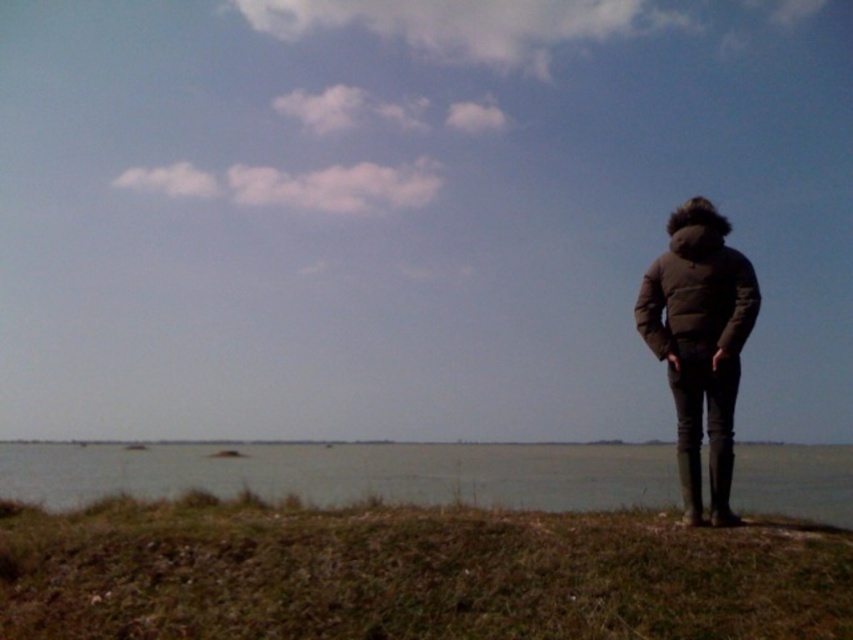
You are a hiker trying to cross the area. The green grass at lower right and the matte black jacket at right are in your path. Which one can you step on?

The green grass at lower right is wider than the matte black jacket at right, so you can step on the green grass at lower right.

You are a hiker trying to cross the water area in the middle. You see the green grass at lower right and the matte black jacket at right. Which direction should you walk to avoid getting wet?

You should walk towards the green grass at lower right because it is positioned on the left side of the matte black jacket at right, meaning it is on the dry land. The water area is in the middle, so moving towards the grass would keep you on solid ground.